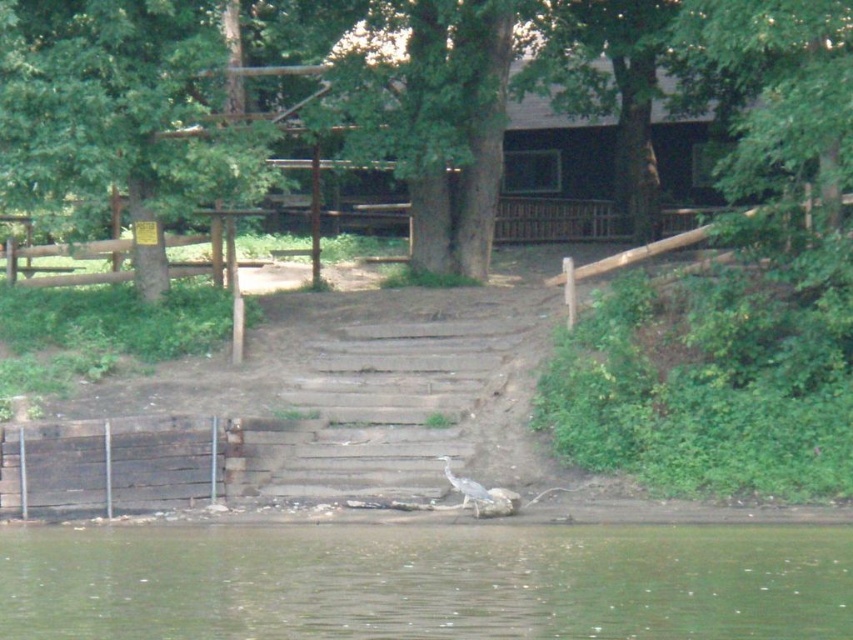
Between point (135, 195) and point (282, 397), which one is positioned in front?

Positioned in front is point (282, 397).

Does green leafy tree at upper left have a lesser height compared to weathered wood stairs at center?

Incorrect, green leafy tree at upper left's height does not fall short of weathered wood stairs at center's.

Locate an element on the screen. green leafy tree at upper left is located at coordinates (119, 115).

Which is more to the left, green liquid water at lower center or green leafy tree at upper left?

green leafy tree at upper left

Measure the distance between point (396, 627) and camera.

Point (396, 627) and camera are 46.44 feet apart.

This screenshot has width=853, height=640. Find the location of `green liquid water at lower center`. green liquid water at lower center is located at coordinates (426, 582).

Between weathered wood stairs at center and gray matte bird at lower center, which one has more height?

With more height is weathered wood stairs at center.

Is point (367, 388) positioned in front of point (473, 483)?

No, it is behind (473, 483).

Does point (421, 340) come behind point (462, 499)?

Yes, point (421, 340) is behind point (462, 499).

Locate an element on the screen. The image size is (853, 640). weathered wood stairs at center is located at coordinates (381, 410).